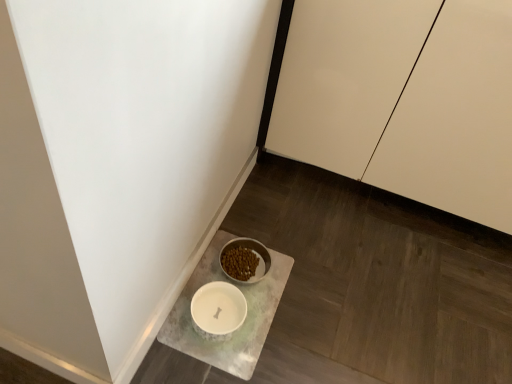
The width and height of the screenshot is (512, 384). What are the coordinates of `free space to the back side of white marble tray at lower center` in the screenshot? It's located at [280, 219].